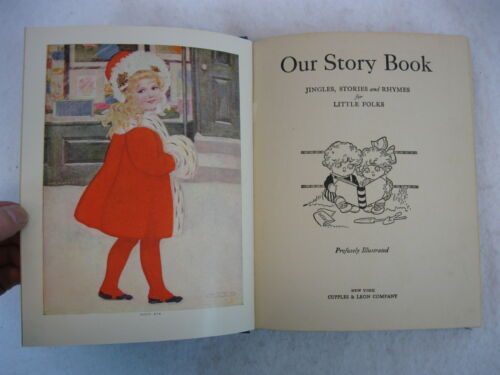
You are a GUI agent. You are given a task and a screenshot of the screen. Output one action in this format:
    pyautogui.click(x=<x>, y=<y>)
    Task: Click on the book
    The width and height of the screenshot is (500, 375).
    Given the screenshot: What is the action you would take?
    pyautogui.click(x=345, y=314), pyautogui.click(x=265, y=233)